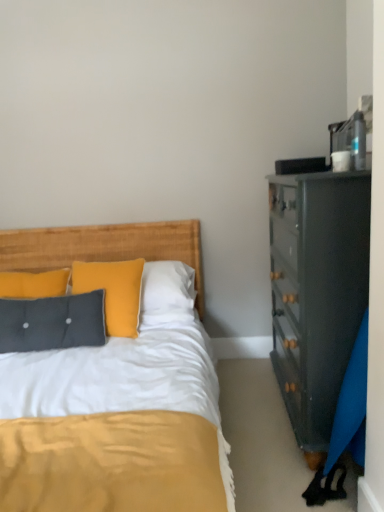
Question: Is textured gray pillow at left located outside woven wood headboard at center?

Choices:
 (A) no
 (B) yes

Answer: (B)

Question: Does textured gray pillow at left have a smaller size compared to woven wood headboard at center?

Choices:
 (A) no
 (B) yes

Answer: (B)

Question: Does textured gray pillow at left have a lesser width compared to woven wood headboard at center?

Choices:
 (A) no
 (B) yes

Answer: (A)

Question: From a real-world perspective, does textured gray pillow at left sit lower than woven wood headboard at center?

Choices:
 (A) no
 (B) yes

Answer: (B)

Question: Considering the relative sizes of textured gray pillow at left and woven wood headboard at center in the image provided, is textured gray pillow at left bigger than woven wood headboard at center?

Choices:
 (A) no
 (B) yes

Answer: (A)

Question: Is textured gray pillow at left at the left side of woven wood headboard at center?

Choices:
 (A) yes
 (B) no

Answer: (A)

Question: From the image's perspective, does woven wood headboard at center appear lower than textured gray pillow at left?

Choices:
 (A) yes
 (B) no

Answer: (B)

Question: Is woven wood headboard at center oriented away from textured gray pillow at left?

Choices:
 (A) no
 (B) yes

Answer: (A)

Question: Does woven wood headboard at center have a smaller size compared to textured gray pillow at left?

Choices:
 (A) yes
 (B) no

Answer: (B)

Question: Considering the relative sizes of woven wood headboard at center and textured gray pillow at left in the image provided, is woven wood headboard at center wider than textured gray pillow at left?

Choices:
 (A) no
 (B) yes

Answer: (A)

Question: Could you tell me if woven wood headboard at center is facing textured gray pillow at left?

Choices:
 (A) no
 (B) yes

Answer: (A)

Question: From the image's perspective, would you say woven wood headboard at center is positioned over textured gray pillow at left?

Choices:
 (A) no
 (B) yes

Answer: (B)

Question: Is textured gray pillow at left to the left or to the right of woven wood headboard at center in the image?

Choices:
 (A) left
 (B) right

Answer: (A)